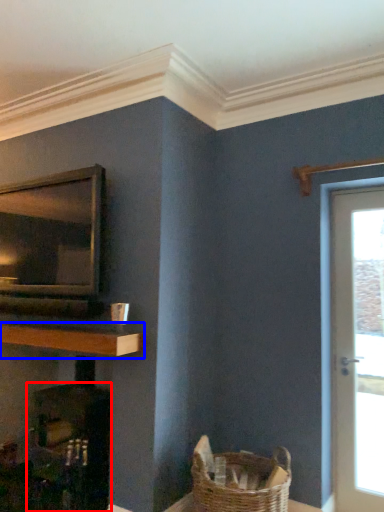
Question: Among these objects, which one is nearest to the camera, fireplace (highlighted by a red box) or shelf (highlighted by a blue box)?

Choices:
 (A) fireplace
 (B) shelf

Answer: (B)